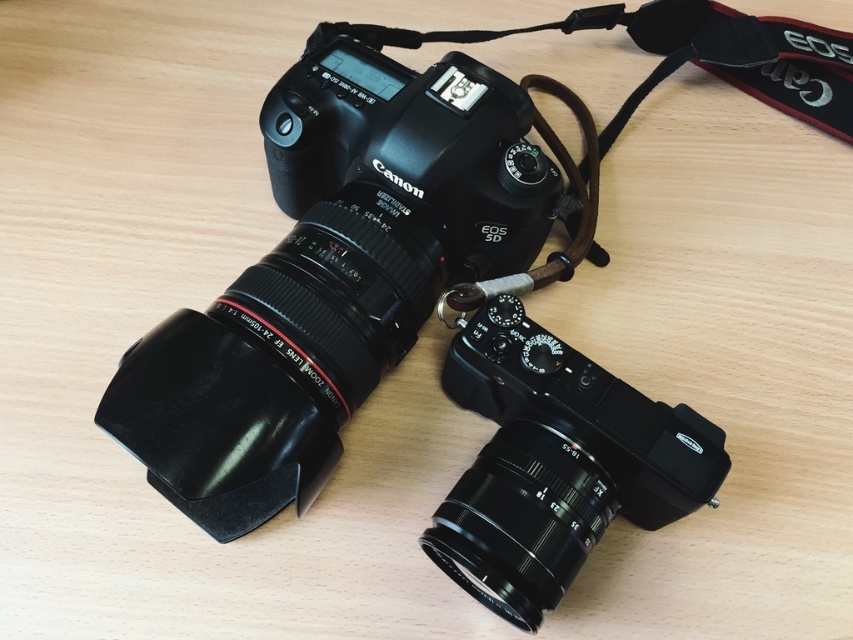
Question: Where is matte black camera at center located in relation to black matte camera at center in the image?

Choices:
 (A) below
 (B) above

Answer: (B)

Question: Can you confirm if matte black camera at center is bigger than brown leather strap at upper center?

Choices:
 (A) yes
 (B) no

Answer: (A)

Question: Considering the relative positions of matte black camera at center and black matte camera at center in the image provided, where is matte black camera at center located with respect to black matte camera at center?

Choices:
 (A) below
 (B) above

Answer: (B)

Question: Which object is positioned closest to the black matte lens at lower center?

Choices:
 (A) matte black camera at center
 (B) black matte camera at center
 (C) brown leather strap at upper center

Answer: (B)

Question: Based on their relative distances, which object is nearer to the brown leather strap at upper center?

Choices:
 (A) matte black camera at center
 (B) black matte camera at center
 (C) black matte lens at lower center

Answer: (A)

Question: Among these points, which one is farthest from the camera?

Choices:
 (A) (271, 268)
 (B) (598, 368)
 (C) (792, 90)
 (D) (552, 445)

Answer: (C)